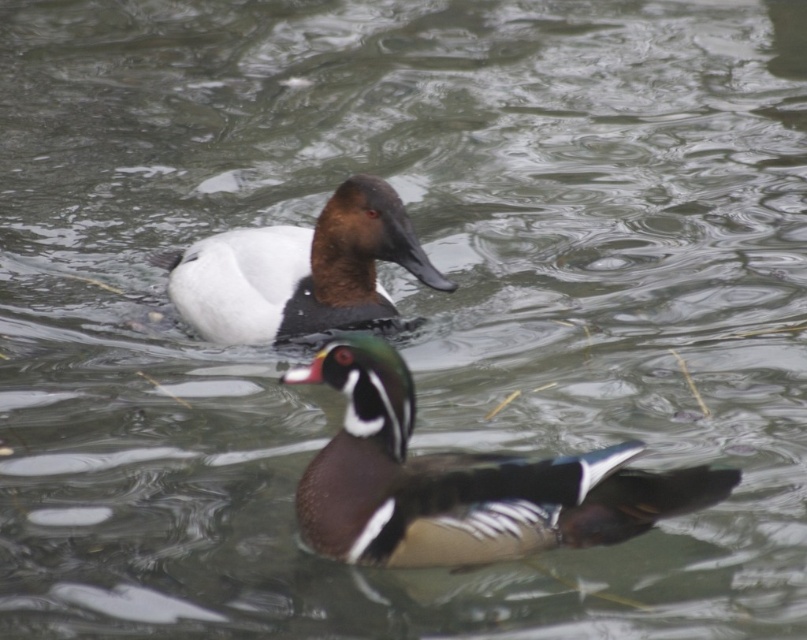
You are a photographer aiming to capture the shiny brown duck at center in a closeup shot. Your camera has a zoom lens that can focus on a specific point. The coordinates of the point you need to focus on are given as point (463, 481). Based on the scene description, where exactly should you focus your camera to capture the shiny brown duck at center?

You should focus your camera on point (463, 481) because that point corresponds to the shiny brown duck at center.

You are observing two ducks in a pond. You notice the shiny brown duck at center and the white matte duck at upper center. Which duck is smaller?

The shiny brown duck at center is smaller than the white matte duck at upper center.